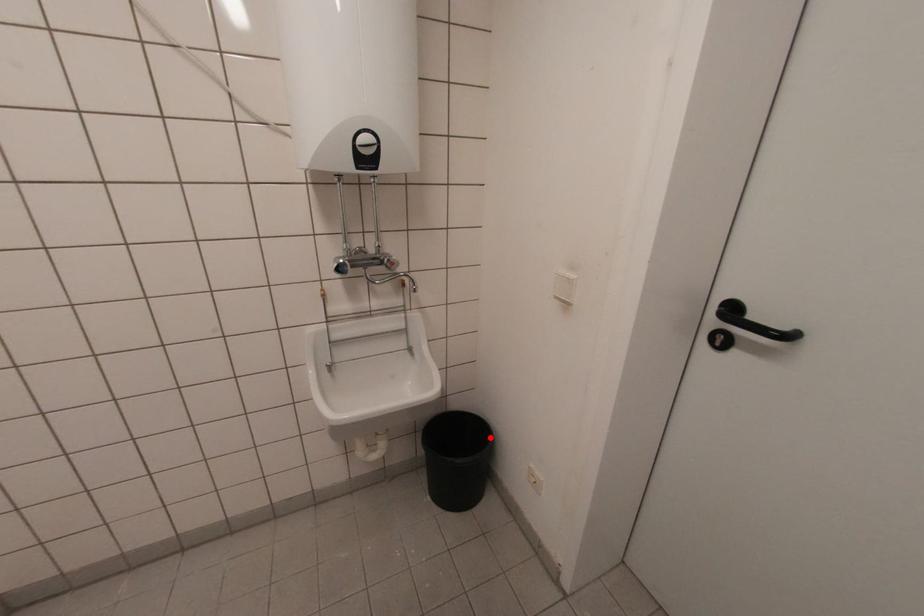
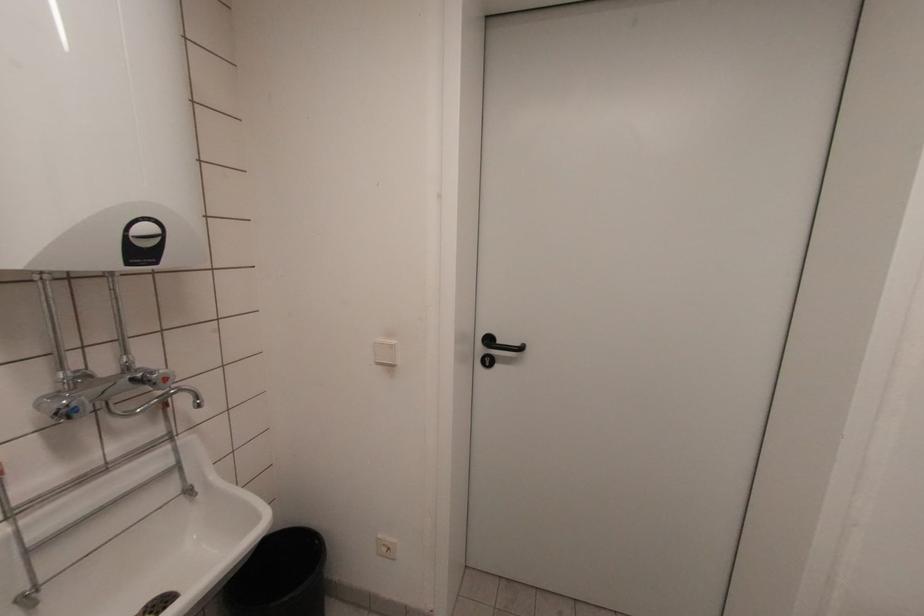
Question: I am providing you with two images of the same scene from different viewpoints. A red point is marked on the first image. At the location where the point appears in image 1, is it still visible in image 2?

Choices:
 (A) Yes
 (B) No

Answer: (A)